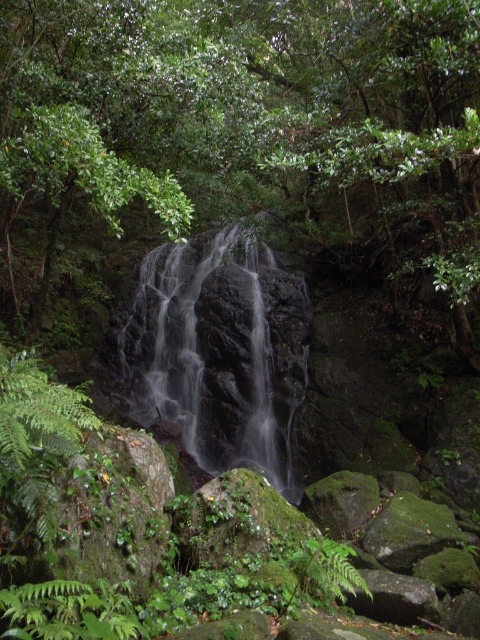
You are standing at the base of the waterfall and want to reach the misty area near the falling water. There are two points marked on the path ahead of you. The first point is at coordinate point(63, 246), and the second is at point(253, 308). Which point should you walk towards to get closer to the waterfall?

You should walk towards point(63, 246) because it is in front of point(253, 308), meaning it is closer to the waterfall.

You are standing at the base of the waterfall and want to take a photo of the green leafy tree at center. If your camera has a maximum focus range of 10 feet, will you need to move closer to the tree to capture it clearly?

The green leafy tree at center is 12.96 feet away from you. Since your camera can only focus up to 10 feet, you need to move closer to the tree to ensure it is in clear focus.